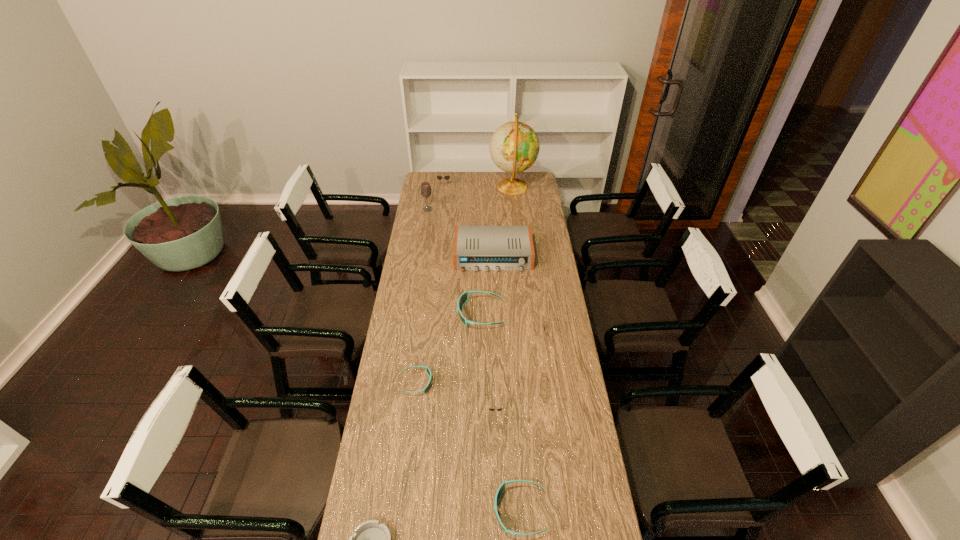
Locate an element on the screen. The image size is (960, 540). globe at the far edge is located at coordinates (514, 147).

Where is `sunglasses positioned at the far edge`? The width and height of the screenshot is (960, 540). sunglasses positioned at the far edge is located at coordinates [x=438, y=177].

Image resolution: width=960 pixels, height=540 pixels. In order to click on glass drink container that is at the left edge in this screenshot , I will do `click(426, 191)`.

Find the location of a particular element. The width and height of the screenshot is (960, 540). globe located at the right edge is located at coordinates pos(514,147).

Where is `radio receiver situated at the right edge`? The image size is (960, 540). radio receiver situated at the right edge is located at coordinates (476, 248).

The width and height of the screenshot is (960, 540). In order to click on sunglasses at the right edge in this screenshot , I will do `click(546, 317)`.

Where is `object that is at the far left corner`? object that is at the far left corner is located at coordinates (438, 177).

Find the location of a particular element. object present at the far right corner is located at coordinates (514, 147).

At what (x,y) coordinates should I click in order to perform the action: click on free location at the left edge of the desktop. Please return your answer as a coordinate pair (x, y). Looking at the image, I should click on (395, 344).

In the image, there is a desktop. At what (x,y) coordinates should I click in order to perform the action: click on vacant region at the right edge. Please return your answer as a coordinate pair (x, y). Looking at the image, I should click on (562, 386).